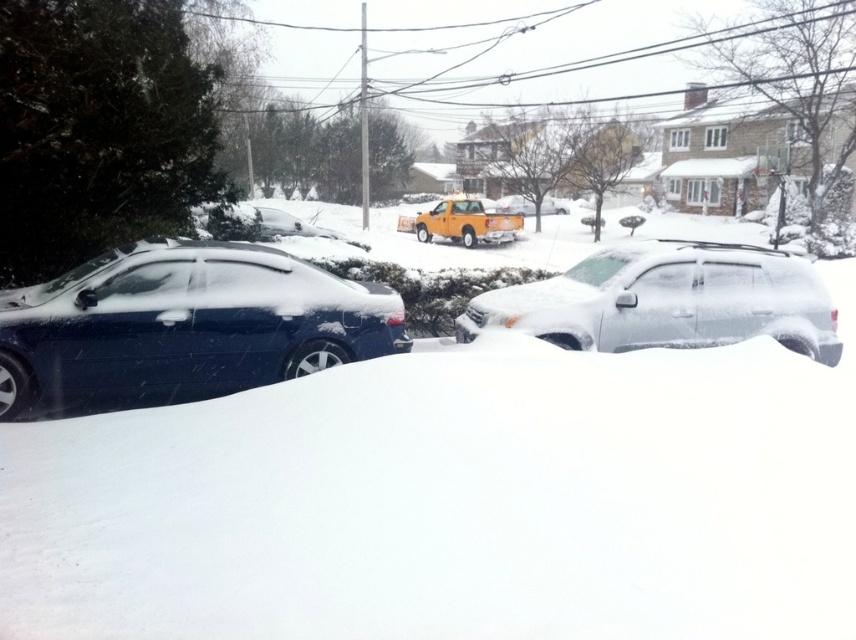
You are standing at the point marked by the coordinate point at (452, 500). Looking around, what do you see directly in front of you?

The point at (452, 500) marks white fluffy snow at center, so you would see white fluffy snow directly in front of you.

You are standing at the point marked as point [669,300]. Which vehicle is directly in front of you?

The sleek silver suv at center is located at point [669,300], so the vehicle directly in front of you is the sleek silver suv at center.